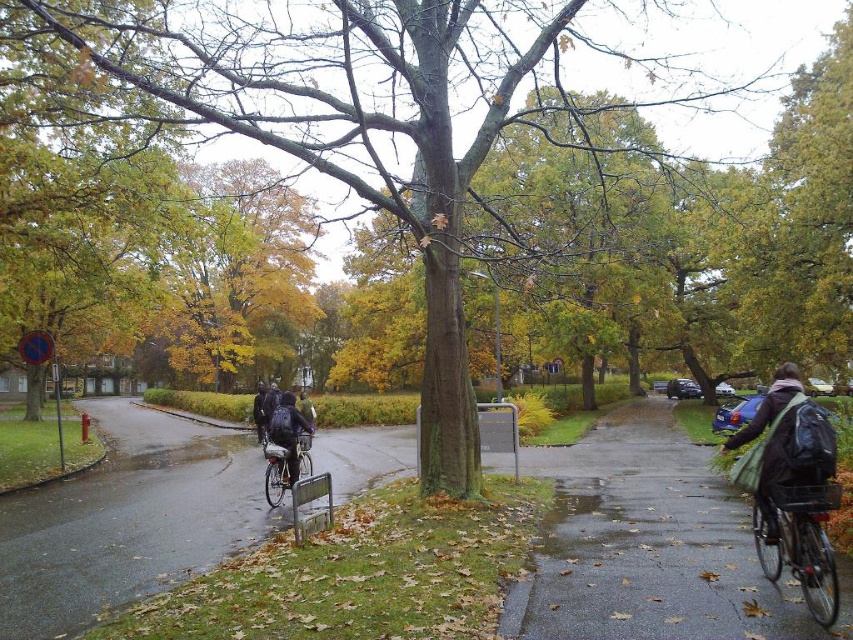
You are standing at the starting point and want to reach the green backpack at right located at point (787, 445). The path is 0.5 meters wide. Your robot has a width of 0.4 meters. Can your robot navigate to the green backpack at right without getting stuck?

The path is 0.5 meters wide, and the robot is 0.4 meters wide, so there is enough space for the robot to navigate to the green backpack at right without getting stuck.

Looking at this image, you are a delivery person who needs to carry a package that requires a backpack larger than the silver metallic bicycle at center. Can the dark blue backpack at center accommodate it?

The dark blue backpack at center has a larger size compared to the silver metallic bicycle at center, so it can accommodate the package.

You are standing at the start of the pathway and notice a dark blue backpack at center. If you walk straight ahead along the path, will the backpack come into your line of sight or move out of it?

The dark blue backpack at center is located at point (x=288, y=433), which means it is positioned along the path. As you walk straight ahead, the backpack will remain in your line of sight until you pass it, after which it will move out of sight behind you.